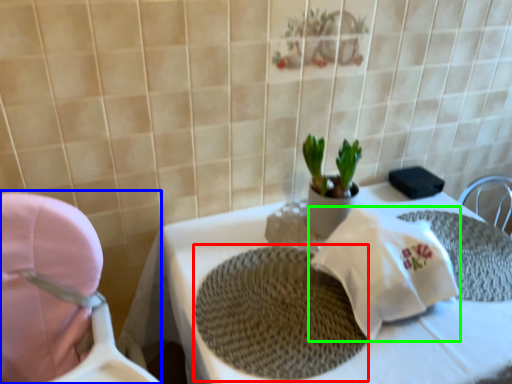
Question: Considering the real-world distances, which object is farthest from place mat (highlighted by a red box)? baby carriage (highlighted by a blue box) or material (highlighted by a green box)?

Choices:
 (A) baby carriage
 (B) material

Answer: (A)